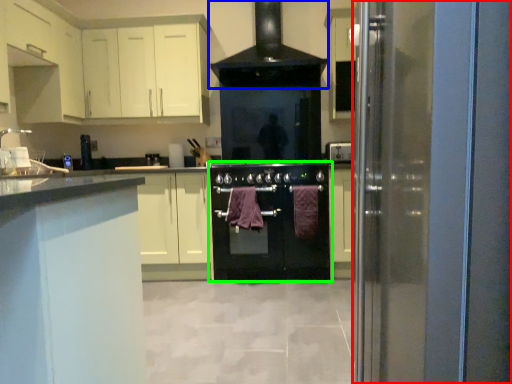
Question: Which is farther away from glass door (highlighted by a red box)? home appliance (highlighted by a blue box) or oven (highlighted by a green box)?

Choices:
 (A) home appliance
 (B) oven

Answer: (A)